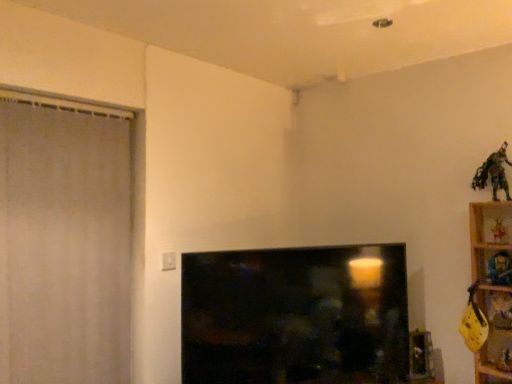
What is the approximate height of wooden shelf at right?

wooden shelf at right is 35.73 inches in height.

Image resolution: width=512 pixels, height=384 pixels. Find the location of `black glossy tv at center`. black glossy tv at center is located at coordinates (295, 316).

What do you see at coordinates (64, 242) in the screenshot?
I see `white fabric screen door at left` at bounding box center [64, 242].

Find the location of a particular element. This screenshot has width=512, height=384. metallic green figure at upper right, which is the sixth toy in bottom-to-top order is located at coordinates (493, 173).

Find the location of a particular element. Image resolution: width=512 pixels, height=384 pixels. yellow fabric toy at right, which is counted as the second toy, starting from the bottom is located at coordinates (473, 322).

You are a GUI agent. You are given a task and a screenshot of the screen. Output one action in this format:
    pyautogui.click(x=<x>, y=<y>)
    Task: Click on the metallic gold figurine at upper right, which is the 4th toy from bottom to top
    The image size is (512, 384).
    Given the screenshot: What is the action you would take?
    pyautogui.click(x=500, y=269)

Locate an element on the screen. wooden shelf at right is located at coordinates (490, 284).

Does white fabric screen door at left have a smaller size compared to wooden shelf at right?

No.

From a real-world perspective, which object stands above the other?

white fabric screen door at left is physically above.

Between white fabric screen door at left and wooden shelf at right, which one has larger width?

Wider between the two is wooden shelf at right.

How much distance is there between white fabric screen door at left and wooden shelf at right?

They are 5.91 feet apart.

Is white fabric screen door at left wider than black glossy tv at center?

No, white fabric screen door at left is not wider than black glossy tv at center.

Is black glossy tv at center inside white fabric screen door at left?

No, white fabric screen door at left does not contain black glossy tv at center.

Is white fabric screen door at left facing away from black glossy tv at center?

No, white fabric screen door at left is not facing the opposite direction of black glossy tv at center.

Considering the sizes of objects yellow fabric toy at right, which is the 5th toy in top-to-bottom order, and metallic green figure at upper right, arranged as the 1th toy when viewed from the top, in the image provided, who is wider, yellow fabric toy at right, which is the 5th toy in top-to-bottom order, or metallic green figure at upper right, arranged as the 1th toy when viewed from the top,?

Wider between the two is yellow fabric toy at right, which is the 5th toy in top-to-bottom order.

From a real-world perspective, is yellow fabric toy at right, which is counted as the second toy, starting from the bottom, physically below metallic green figure at upper right, which is the sixth toy in bottom-to-top order?

Yes, from a real-world perspective, yellow fabric toy at right, which is counted as the second toy, starting from the bottom, is under metallic green figure at upper right, which is the sixth toy in bottom-to-top order.

From the image's perspective, who appears lower, yellow fabric toy at right, which is the 5th toy in top-to-bottom order, or metallic green figure at upper right, which is the sixth toy in bottom-to-top order?

From the image's view, yellow fabric toy at right, which is the 5th toy in top-to-bottom order, is below.

Is point (461, 333) closer to viewer compared to point (493, 182)?

No, it is behind (493, 182).

Who is bigger, yellow fabric toy at lower right, the first toy from the bottom, or yellow fabric toy at right, which is counted as the second toy, starting from the bottom?

With larger size is yellow fabric toy at right, which is counted as the second toy, starting from the bottom.

Is yellow fabric toy at lower right, the first toy from the bottom, in contact with yellow fabric toy at right, which is counted as the second toy, starting from the bottom?

No, yellow fabric toy at lower right, the first toy from the bottom, is not beside yellow fabric toy at right, which is counted as the second toy, starting from the bottom.

Based on their positions, is yellow fabric toy at lower right, the first toy from the bottom, located to the left or right of yellow fabric toy at right, which is the 5th toy in top-to-bottom order?

Clearly, yellow fabric toy at lower right, the first toy from the bottom, is on the right of yellow fabric toy at right, which is the 5th toy in top-to-bottom order, in the image.

Relative to yellow fabric toy at right, which is counted as the second toy, starting from the bottom, is yellow fabric toy at lower right, the first toy from the bottom, in front or behind?

In the image, yellow fabric toy at lower right, the first toy from the bottom, appears behind yellow fabric toy at right, which is counted as the second toy, starting from the bottom.

Is point (504, 238) farther from camera compared to point (494, 175)?

No, it is in front of (494, 175).

Based on the photo, can you confirm if wooden toy at upper right, which is the fifth toy in bottom-to-top order, is wider than metallic green figure at upper right, arranged as the 1th toy when viewed from the top?

In fact, wooden toy at upper right, which is the fifth toy in bottom-to-top order, might be narrower than metallic green figure at upper right, arranged as the 1th toy when viewed from the top.

Is wooden toy at upper right, the 2th toy in the top-to-bottom sequence, oriented towards metallic green figure at upper right, which is the sixth toy in bottom-to-top order?

No.

Is wooden toy at upper right, which is the fifth toy in bottom-to-top order, inside or outside of metallic green figure at upper right, arranged as the 1th toy when viewed from the top?

wooden toy at upper right, which is the fifth toy in bottom-to-top order, lies outside metallic green figure at upper right, arranged as the 1th toy when viewed from the top.

Which object is thinner, wooden shelf at right or yellow fabric toy at right, which is the 5th toy in top-to-bottom order?

wooden shelf at right.

From the image's perspective, does wooden shelf at right appear higher than yellow fabric toy at right, which is the 5th toy in top-to-bottom order?

Correct, wooden shelf at right appears higher than yellow fabric toy at right, which is the 5th toy in top-to-bottom order, in the image.

Considering the relative positions of wooden shelf at right and yellow fabric toy at right, which is the 5th toy in top-to-bottom order, in the image provided, is wooden shelf at right to the left of yellow fabric toy at right, which is the 5th toy in top-to-bottom order, from the viewer's perspective?

No, wooden shelf at right is not to the left of yellow fabric toy at right, which is the 5th toy in top-to-bottom order.

What's the angular difference between wooden shelf at right and yellow fabric toy at right, which is the 5th toy in top-to-bottom order,'s facing directions?

24.2 degrees.

From the image's perspective, which one is positioned lower, yellow fabric toy at lower right, the first toy from the bottom, or white fabric screen door at left?

yellow fabric toy at lower right, the first toy from the bottom, from the image's perspective.

Measure the distance from yellow fabric toy at lower right, the first toy from the bottom, to white fabric screen door at left.

yellow fabric toy at lower right, the first toy from the bottom, and white fabric screen door at left are 6.56 feet apart from each other.

Is yellow fabric toy at lower right, the first toy from the bottom, at the right side of white fabric screen door at left?

Correct, you'll find yellow fabric toy at lower right, the first toy from the bottom, to the right of white fabric screen door at left.

Is yellow fabric toy at lower right, placed as the sixth toy when sorted from top to bottom, facing towards white fabric screen door at left?

No, yellow fabric toy at lower right, placed as the sixth toy when sorted from top to bottom, does not turn towards white fabric screen door at left.

Image resolution: width=512 pixels, height=384 pixels. In order to click on screen door to the left of wooden shelf at right in this screenshot , I will do `click(64, 242)`.

You are a GUI agent. You are given a task and a screenshot of the screen. Output one action in this format:
    pyautogui.click(x=<x>, y=<y>)
    Task: Click on the screen door located above the black glossy tv at center (from a real-world perspective)
    The image size is (512, 384).
    Given the screenshot: What is the action you would take?
    pyautogui.click(x=64, y=242)

Consider the image. Based on their spatial positions, is wooden toy at upper right, which is the fifth toy in bottom-to-top order, or yellow fabric toy at lower right, placed as the sixth toy when sorted from top to bottom, further from metallic green figure at upper right, which is the sixth toy in bottom-to-top order?

The object further to metallic green figure at upper right, which is the sixth toy in bottom-to-top order, is yellow fabric toy at lower right, placed as the sixth toy when sorted from top to bottom.

Estimate the real-world distances between objects in this image. Which object is closer to black glossy tv at center, wooden toy at upper right, the 2th toy in the top-to-bottom sequence, or yellow fabric toy at lower right, the first toy from the bottom?

Among the two, yellow fabric toy at lower right, the first toy from the bottom, is located nearer to black glossy tv at center.

From the image, which object appears to be farther from white fabric screen door at left, yellow fabric toy at lower right, the first toy from the bottom, or yellow fabric toy at right, which is the 5th toy in top-to-bottom order?

yellow fabric toy at lower right, the first toy from the bottom.

Looking at the image, which one is located closer to metallic green figure at upper right, arranged as the 1th toy when viewed from the top, plush fabric toy at upper right, positioned as the fourth toy in top-to-bottom order, or yellow fabric toy at lower right, placed as the sixth toy when sorted from top to bottom?

Among the two, plush fabric toy at upper right, positioned as the fourth toy in top-to-bottom order, is located nearer to metallic green figure at upper right, arranged as the 1th toy when viewed from the top.

Estimate the real-world distances between objects in this image. Which object is closer to metallic gold figurine at upper right, which is the 4th toy from bottom to top, wooden toy at upper right, the 2th toy in the top-to-bottom sequence, or wooden shelf at right?

wooden toy at upper right, the 2th toy in the top-to-bottom sequence, is positioned closer to the anchor metallic gold figurine at upper right, which is the 4th toy from bottom to top.

Based on the photo, which object lies further to the anchor point yellow fabric toy at right, which is the 5th toy in top-to-bottom order, white fabric screen door at left or wooden toy at upper right, which is the fifth toy in bottom-to-top order?

Based on the image, white fabric screen door at left appears to be further to yellow fabric toy at right, which is the 5th toy in top-to-bottom order.

Considering their positions, is plush fabric toy at upper right, placed as the 3th toy when sorted from bottom to top, positioned closer to metallic gold figurine at upper right, acting as the third toy starting from the top, than wooden toy at upper right, which is the fifth toy in bottom-to-top order?

plush fabric toy at upper right, placed as the 3th toy when sorted from bottom to top.

Which object lies further to the anchor point white fabric screen door at left, plush fabric toy at upper right, placed as the 3th toy when sorted from bottom to top, or metallic gold figurine at upper right, acting as the third toy starting from the top?

Among the two, plush fabric toy at upper right, placed as the 3th toy when sorted from bottom to top, is located further to white fabric screen door at left.

The image size is (512, 384). I want to click on television between white fabric screen door at left and yellow fabric toy at right, which is the 5th toy in top-to-bottom order, so click(x=295, y=316).

Locate an element on the screen. The image size is (512, 384). toy situated between white fabric screen door at left and metallic green figure at upper right, arranged as the 1th toy when viewed from the top, from left to right is located at coordinates (473, 322).

You are a GUI agent. You are given a task and a screenshot of the screen. Output one action in this format:
    pyautogui.click(x=<x>, y=<y>)
    Task: Click on the furniture situated between black glossy tv at center and wooden toy at upper right, the 2th toy in the top-to-bottom sequence, from left to right
    The width and height of the screenshot is (512, 384).
    Given the screenshot: What is the action you would take?
    pyautogui.click(x=490, y=284)

This screenshot has height=384, width=512. I want to click on furniture between metallic gold figurine at upper right, acting as the third toy starting from the top, and plush fabric toy at upper right, placed as the 3th toy when sorted from bottom to top, vertically, so click(490, 284).